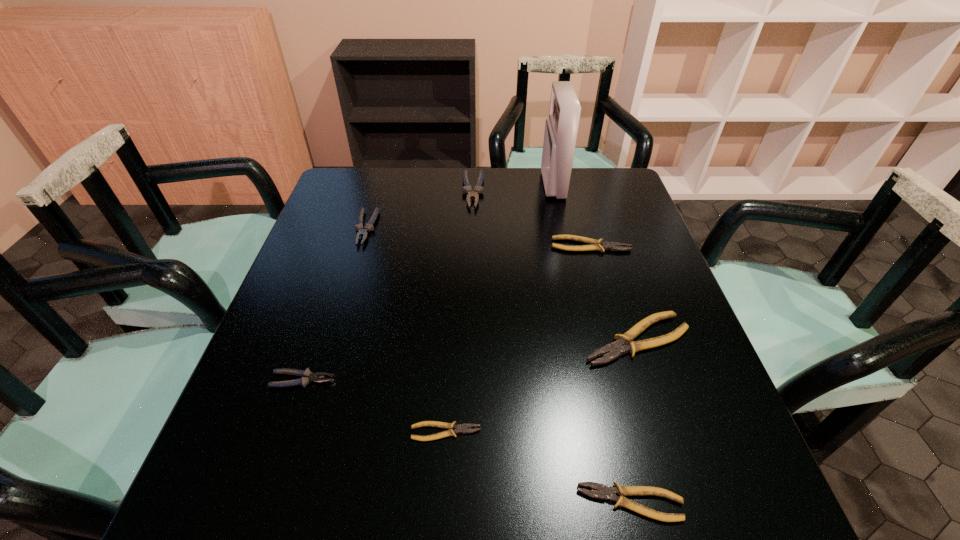
I want to click on the second shortest object, so pos(604,492).

Identify the location of the third biggest yellow pliers. This screenshot has width=960, height=540. (604, 492).

Find the location of a particular element. The height and width of the screenshot is (540, 960). the shortest pliers is located at coordinates (463, 428).

Locate an element on the screen. the third farthest yellow pliers is located at coordinates 463,428.

You are a GUI agent. You are given a task and a screenshot of the screen. Output one action in this format:
    pyautogui.click(x=<x>, y=<y>)
    Task: Click on the vacant space located 0.090m on the front-facing side of the red first-aid kit
    
    Given the screenshot: What is the action you would take?
    pyautogui.click(x=515, y=185)

I want to click on vacant space situated on the front-facing side of the red first-aid kit, so coord(439,185).

Where is `vacant space located on the front-facing side of the red first-aid kit`? The image size is (960, 540). vacant space located on the front-facing side of the red first-aid kit is located at coordinates (492, 185).

Locate an element on the screen. vacant space located 0.200m at the gripping part of the biggest gray pliers is located at coordinates (471, 256).

Identify the location of vacant space located at the gripping part of the second biggest gray pliers. The height and width of the screenshot is (540, 960). (321, 376).

Where is `vacant point located on the left of the fourth nearest object`? This screenshot has height=540, width=960. vacant point located on the left of the fourth nearest object is located at coordinates (522, 340).